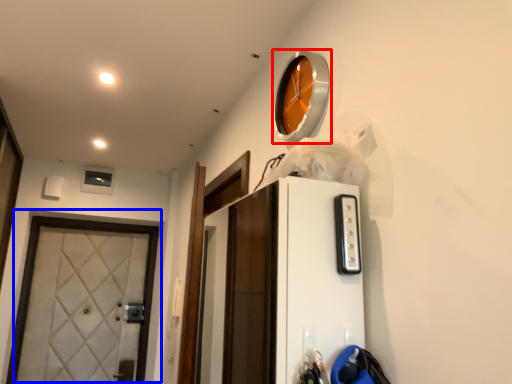
Question: Which point is further to the camera, clock (highlighted by a red box) or door (highlighted by a blue box)?

Choices:
 (A) clock
 (B) door

Answer: (B)